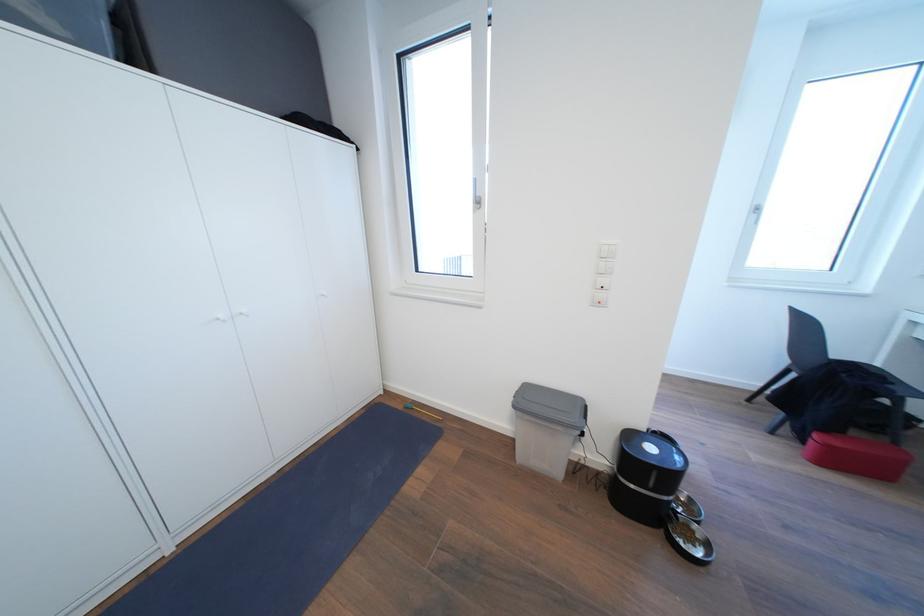
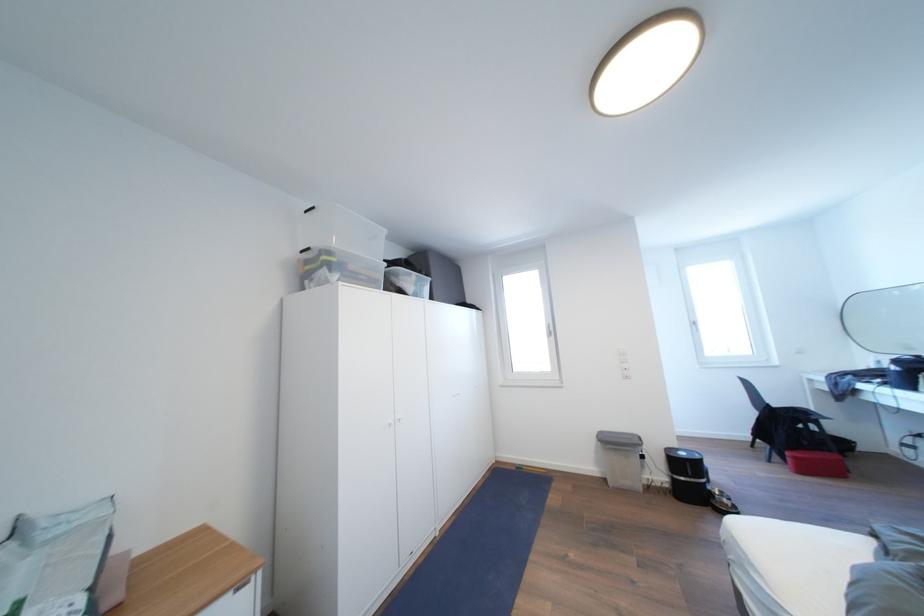
Find the pixel in the second image that matches pixel 835 451 in the first image.

(803, 463)